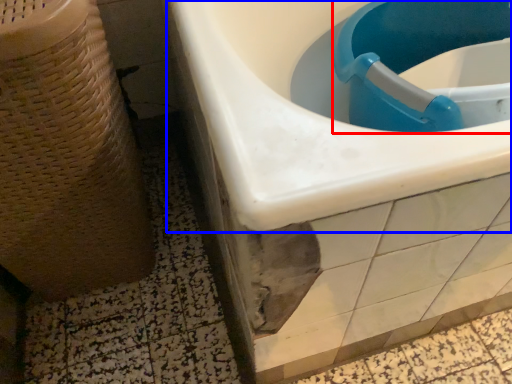
Question: Which of the following is the farthest to the observer, sink (highlighted by a red box) or sink (highlighted by a blue box)?

Choices:
 (A) sink
 (B) sink

Answer: (B)